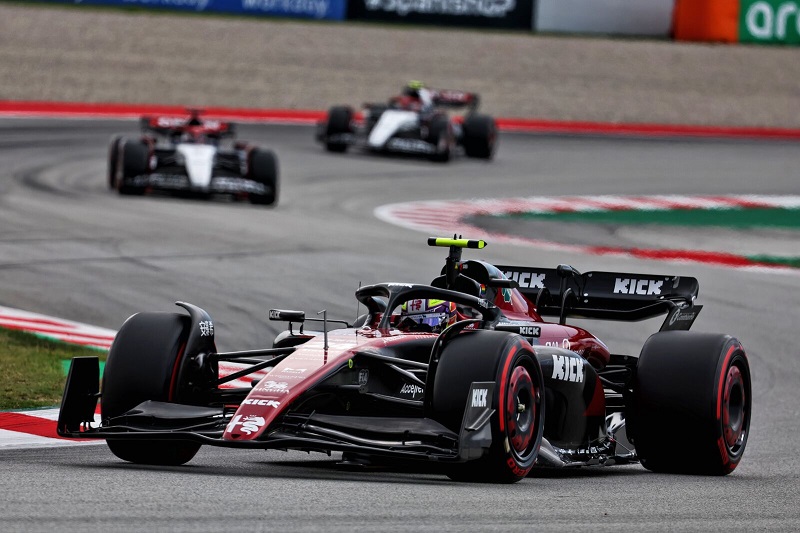
Find the location of a particular element. This screenshot has width=800, height=533. hood is located at coordinates tap(305, 344).